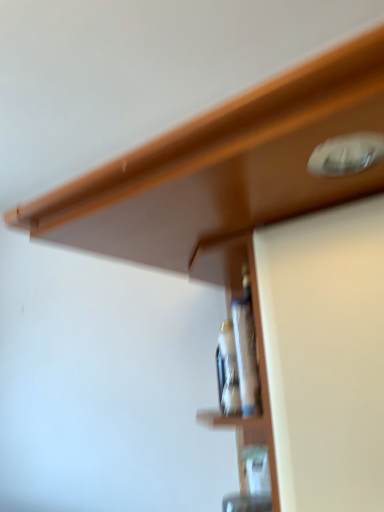
Question: From a real-world perspective, is translucent glass bottle at center, the first bottle when ordered from front to back, physically located above or below translucent glass bottle at center, the 1th bottle viewed from the back?

Choices:
 (A) below
 (B) above

Answer: (B)

Question: Is translucent glass bottle at center, the first bottle when ordered from front to back, taller or shorter than translucent glass bottle at center, the 1th bottle viewed from the back?

Choices:
 (A) short
 (B) tall

Answer: (B)

Question: Is translucent glass bottle at center, the first bottle when ordered from front to back, in front of or behind translucent glass bottle at center, the 2th bottle when ordered from front to back, in the image?

Choices:
 (A) front
 (B) behind

Answer: (A)

Question: From a real-world perspective, is translucent glass bottle at center, the 1th bottle viewed from the back, above or below translucent glass bottle at center, acting as the second bottle starting from the back?

Choices:
 (A) below
 (B) above

Answer: (A)

Question: Is translucent glass bottle at center, the 1th bottle viewed from the back, taller or shorter than translucent glass bottle at center, the first bottle when ordered from front to back?

Choices:
 (A) short
 (B) tall

Answer: (A)

Question: Looking at the image, does translucent glass bottle at center, the 1th bottle viewed from the back, seem bigger or smaller compared to translucent glass bottle at center, acting as the second bottle starting from the back?

Choices:
 (A) big
 (B) small

Answer: (A)

Question: In terms of width, does translucent glass bottle at center, the 1th bottle viewed from the back, look wider or thinner when compared to translucent glass bottle at center, acting as the second bottle starting from the back?

Choices:
 (A) thin
 (B) wide

Answer: (B)